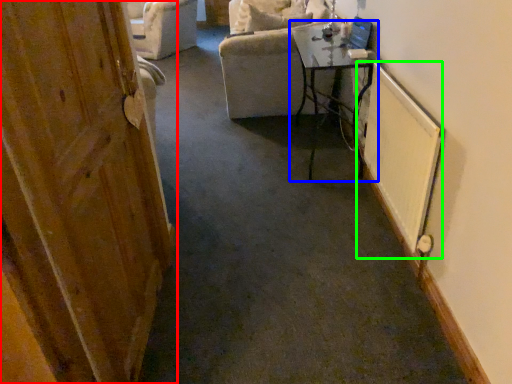
Question: Which object is positioned closest to door (highlighted by a red box)? Select from table (highlighted by a blue box) and radiator (highlighted by a green box).

Choices:
 (A) table
 (B) radiator

Answer: (B)